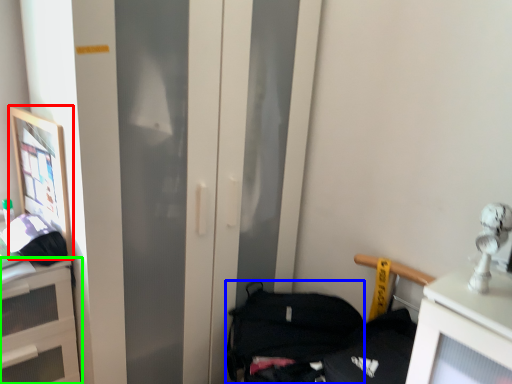
Question: Based on their relative distances, which object is farther from picture frame (highlighted by a red box)? Choose from handbag (highlighted by a blue box) and cabinetry (highlighted by a green box).

Choices:
 (A) handbag
 (B) cabinetry

Answer: (A)